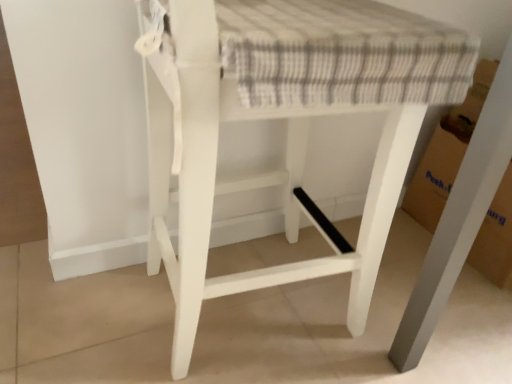
The width and height of the screenshot is (512, 384). I want to click on cardboard at lower right, so click(x=447, y=152).

The image size is (512, 384). What do you see at coordinates (447, 152) in the screenshot?
I see `cardboard at lower right` at bounding box center [447, 152].

Based on the photo, what is the approximate height of white painted wood stool at center?

It is 27.87 inches.

What is the approximate width of white painted wood stool at center?

white painted wood stool at center is 20.10 inches in width.

The image size is (512, 384). What are the coordinates of `white painted wood stool at center` in the screenshot? It's located at (267, 171).

This screenshot has height=384, width=512. Describe the element at coordinates (267, 171) in the screenshot. I see `white painted wood stool at center` at that location.

Where is `cardboard at lower right`? The image size is (512, 384). cardboard at lower right is located at coordinates (447, 152).

Is cardboard at lower right at the right side of white painted wood stool at center?

Yes.

Does cardboard at lower right come in front of white painted wood stool at center?

No, cardboard at lower right is behind white painted wood stool at center.

Considering the positions of point (508, 209) and point (163, 170), is point (508, 209) closer or farther from the camera than point (163, 170)?

Point (508, 209) appears to be farther away from the viewer than point (163, 170).

From the image's perspective, is cardboard at lower right located above white painted wood stool at center?

Yes, from the image's perspective, cardboard at lower right is on top of white painted wood stool at center.

From a real-world perspective, does cardboard at lower right stand above white painted wood stool at center?

No.

Which of these two, cardboard at lower right or white painted wood stool at center, is thinner?

cardboard at lower right is thinner.

Is cardboard at lower right taller or shorter than white painted wood stool at center?

cardboard at lower right is shorter than white painted wood stool at center.

Considering the sizes of objects cardboard at lower right and white painted wood stool at center in the image provided, who is bigger, cardboard at lower right or white painted wood stool at center?

white painted wood stool at center.

Looking at this image, do you think cardboard at lower right is within white painted wood stool at center, or outside of it?

The correct answer is: outside.

Is cardboard at lower right next to white painted wood stool at center and touching it?

No, cardboard at lower right is not touching white painted wood stool at center.

Is cardboard at lower right looking in the opposite direction of white painted wood stool at center?

No.

What's the angular difference between cardboard at lower right and white painted wood stool at center's facing directions?

The facing directions of cardboard at lower right and white painted wood stool at center are 89.5 degrees apart.

Identify the location of cardboard box behind the white painted wood stool at center. (447, 152).

Is white painted wood stool at center to the left or to the right of cardboard at lower right in the image?

In the image, white painted wood stool at center appears on the left side of cardboard at lower right.

Is the position of white painted wood stool at center less distant than that of cardboard at lower right?

Yes, white painted wood stool at center is in front of cardboard at lower right.

Is point (217, 143) less distant than point (457, 170)?

Yes.

From the image's perspective, would you say white painted wood stool at center is shown under cardboard at lower right?

Yes, from the image's perspective, white painted wood stool at center is below cardboard at lower right.

From a real-world perspective, is white painted wood stool at center physically below cardboard at lower right?

No, from a real-world perspective, white painted wood stool at center is not below cardboard at lower right.

Between white painted wood stool at center and cardboard at lower right, which one has smaller width?

With smaller width is cardboard at lower right.

In the scene shown: From their relative heights in the image, would you say white painted wood stool at center is taller or shorter than cardboard at lower right?

In the image, white painted wood stool at center appears to be taller than cardboard at lower right.

Which of these two, white painted wood stool at center or cardboard at lower right, is smaller?

Result: cardboard at lower right is smaller.

Is white painted wood stool at center not inside cardboard at lower right?

Indeed, white painted wood stool at center is completely outside cardboard at lower right.

Is white painted wood stool at center positioned far away from cardboard at lower right?

Actually, white painted wood stool at center and cardboard at lower right are a little close together.

Is white painted wood stool at center oriented towards cardboard at lower right?

Yes, white painted wood stool at center faces towards cardboard at lower right.

Locate an element on the screen. furniture above the cardboard at lower right (from a real-world perspective) is located at coordinates (267, 171).

I want to click on cardboard box on the right of white painted wood stool at center, so click(447, 152).

This screenshot has height=384, width=512. In order to click on cardboard box that is under the white painted wood stool at center (from a real-world perspective) in this screenshot , I will do `click(447, 152)`.